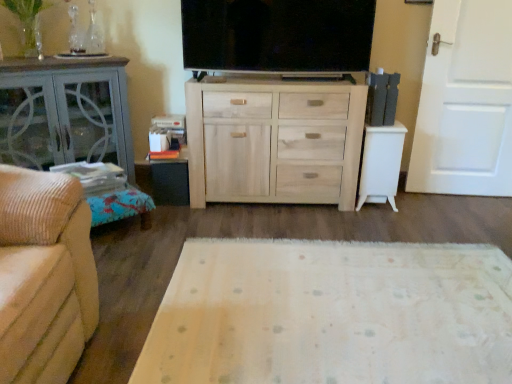
Question: Does black matte table at lower left, placed as the second table when sorted from right to left, appear on the right side of flat screen tv at center?

Choices:
 (A) yes
 (B) no

Answer: (B)

Question: Is black matte table at lower left, the second table positioned from the left, positioned behind flat screen tv at center?

Choices:
 (A) yes
 (B) no

Answer: (A)

Question: From the image's perspective, is black matte table at lower left, the second table positioned from the left, on flat screen tv at center?

Choices:
 (A) yes
 (B) no

Answer: (B)

Question: Is black matte table at lower left, the second table positioned from the left, bigger than flat screen tv at center?

Choices:
 (A) yes
 (B) no

Answer: (B)

Question: Does black matte table at lower left, placed as the second table when sorted from right to left, have a smaller size compared to flat screen tv at center?

Choices:
 (A) yes
 (B) no

Answer: (A)

Question: Considering the relative sizes of black matte table at lower left, placed as the second table when sorted from right to left, and flat screen tv at center in the image provided, is black matte table at lower left, placed as the second table when sorted from right to left, wider than flat screen tv at center?

Choices:
 (A) yes
 (B) no

Answer: (A)

Question: Is white wooden door at right taller than flat screen tv at center?

Choices:
 (A) yes
 (B) no

Answer: (A)

Question: Considering the relative sizes of white wooden door at right and flat screen tv at center in the image provided, is white wooden door at right bigger than flat screen tv at center?

Choices:
 (A) no
 (B) yes

Answer: (B)

Question: Does white wooden door at right have a smaller size compared to flat screen tv at center?

Choices:
 (A) no
 (B) yes

Answer: (A)

Question: Does white wooden door at right have a lesser width compared to flat screen tv at center?

Choices:
 (A) no
 (B) yes

Answer: (B)

Question: Considering the relative positions of white wooden door at right and flat screen tv at center in the image provided, is white wooden door at right to the right of flat screen tv at center from the viewer's perspective?

Choices:
 (A) yes
 (B) no

Answer: (A)

Question: Can you confirm if white wooden door at right is wider than flat screen tv at center?

Choices:
 (A) yes
 (B) no

Answer: (B)

Question: Is white glossy side table at right, the 3th table in the left-to-right sequence, far from black matte table at lower left, the second table positioned from the left?

Choices:
 (A) yes
 (B) no

Answer: (A)